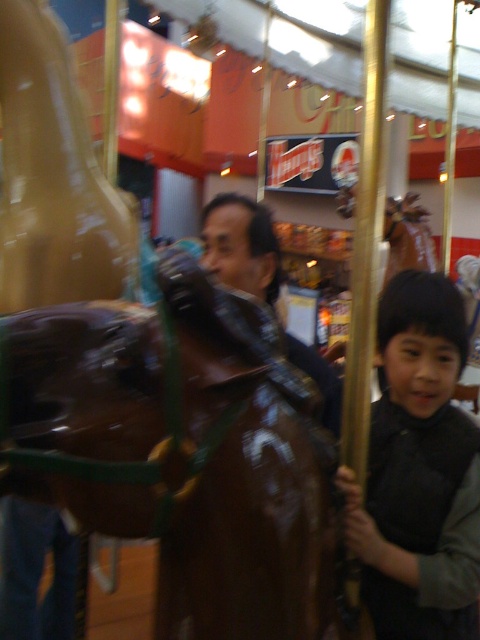
Between point (432, 364) and point (302, 356), which one is positioned behind?

The point (302, 356) is more distant.

Can you confirm if smooth black jacket at right is shorter than shiny brown leather jacket at center?

Incorrect, smooth black jacket at right's height does not fall short of shiny brown leather jacket at center's.

Where is `smooth black jacket at right`? The height and width of the screenshot is (640, 480). smooth black jacket at right is located at coordinates pyautogui.click(x=419, y=472).

The image size is (480, 640). I want to click on smooth black jacket at right, so (x=419, y=472).

Is shiny brown horse at center taller than shiny brown leather jacket at center?

No, shiny brown horse at center is not taller than shiny brown leather jacket at center.

Is point (256, 534) closer to viewer compared to point (324, 372)?

Yes, point (256, 534) is closer to viewer.

Measure the distance between point (x=47, y=396) and camera.

Point (x=47, y=396) is 33.05 inches away from camera.

Where is `shiny brown horse at center`? shiny brown horse at center is located at coordinates (180, 449).

Does shiny brown horse at center have a smaller size compared to smooth black jacket at right?

No.

Between point (72, 340) and point (392, 422), which one is positioned behind?

The point (392, 422) is behind.

Locate an element on the screen. Image resolution: width=480 pixels, height=640 pixels. shiny brown horse at center is located at coordinates (180, 449).

The image size is (480, 640). Identify the location of shiny brown horse at center. (180, 449).